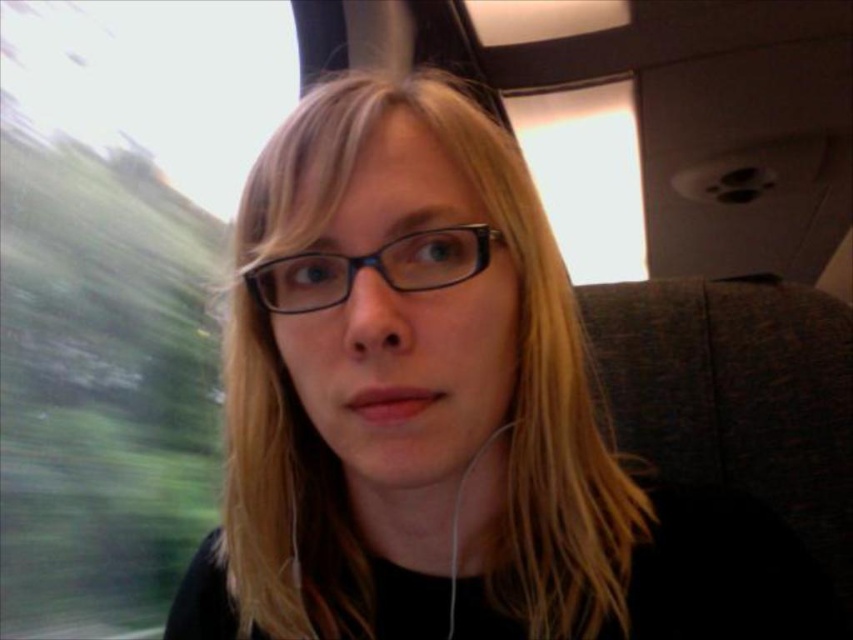
Is blue plastic glasses at center to the left of white matte earphone at lower center from the viewer's perspective?

Correct, you'll find blue plastic glasses at center to the left of white matte earphone at lower center.

Measure the distance between blue plastic glasses at center and camera.

The distance of blue plastic glasses at center from camera is 12.90 inches.

What do you see at coordinates (372, 268) in the screenshot? I see `blue plastic glasses at center` at bounding box center [372, 268].

At what (x,y) coordinates should I click in order to perform the action: click on blue plastic glasses at center. Please return your answer as a coordinate pair (x, y). This screenshot has width=853, height=640. Looking at the image, I should click on (372, 268).

The height and width of the screenshot is (640, 853). Describe the element at coordinates (519, 353) in the screenshot. I see `blonde hair at center` at that location.

Is blonde hair at center smaller than blue plastic glasses at center?

No, blonde hair at center is not smaller than blue plastic glasses at center.

Locate an element on the screen. The image size is (853, 640). blonde hair at center is located at coordinates (519, 353).

Between point (537, 618) and point (463, 474), which one is positioned in front?

Point (537, 618) is in front.

Is point (256, 568) positioned behind point (486, 444)?

Yes, point (256, 568) is behind point (486, 444).

Which is in front, point (618, 596) or point (454, 518)?

Point (618, 596) is in front.

The image size is (853, 640). What are the coordinates of `blonde hair at center` in the screenshot? It's located at (519, 353).